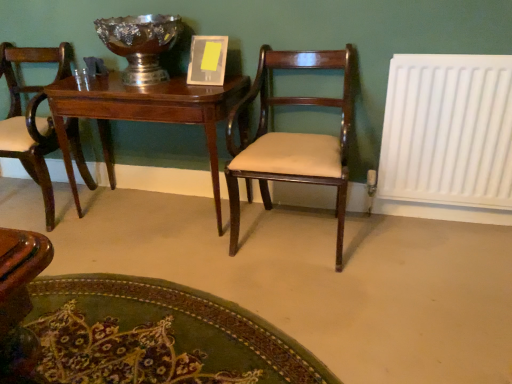
Find the location of a particular element. vacant area that is in front of mahogany wood table at center is located at coordinates (160, 254).